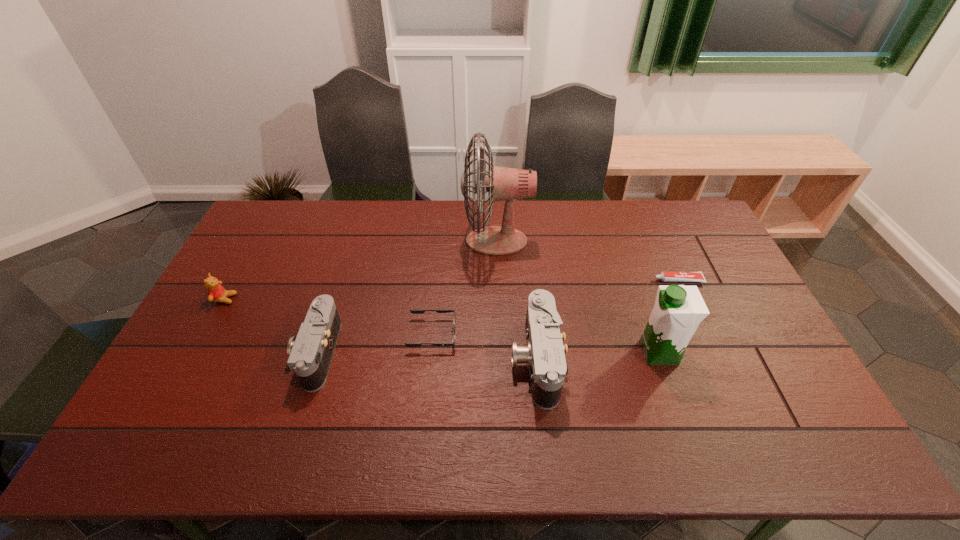
You are a GUI agent. You are given a task and a screenshot of the screen. Output one action in this format:
    pyautogui.click(x=<x>, y=<y>)
    Task: Click on the toothpaste
    
    Given the screenshot: What is the action you would take?
    pyautogui.click(x=664, y=276)

At what (x,y) coordinates should I click in order to perform the action: click on the rightmost object. Please return your answer as a coordinate pair (x, y). The image size is (960, 540). Looking at the image, I should click on (664, 276).

This screenshot has width=960, height=540. What are the coordinates of `the sixth shortest object` in the screenshot? It's located at (678, 310).

Find the location of a particular element. the sixth object from left to right is located at coordinates (678, 310).

Where is `vacant space situated on the lens of the left camera`? This screenshot has width=960, height=540. vacant space situated on the lens of the left camera is located at coordinates click(198, 353).

You are a GUI agent. You are given a task and a screenshot of the screen. Output one action in this format:
    pyautogui.click(x=<x>, y=<y>)
    Task: Click on the free space located on the lens of the left camera
    The height and width of the screenshot is (540, 960).
    Given the screenshot: What is the action you would take?
    pyautogui.click(x=252, y=353)

Image resolution: width=960 pixels, height=540 pixels. I want to click on vacant area situated on the lens of the left camera, so coord(229,353).

The image size is (960, 540). I want to click on free space located 0.160m on the lens of the fifth shortest object, so click(453, 360).

Where is `vacant space located on the lens of the fifth shortest object`? Image resolution: width=960 pixels, height=540 pixels. vacant space located on the lens of the fifth shortest object is located at coordinates (372, 360).

Find the location of a particular element. The width and height of the screenshot is (960, 540). vacant space located 0.370m on the lens of the fifth shortest object is located at coordinates (376, 360).